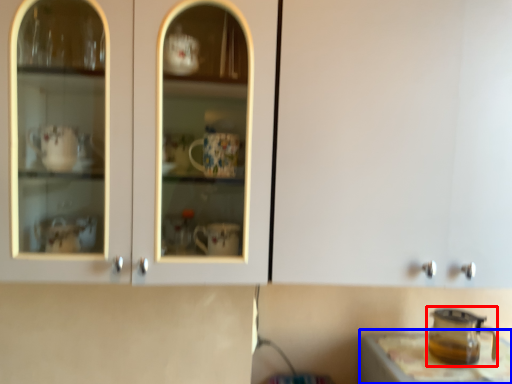
Question: Which of the following is the farthest to the observer, appliance (highlighted by a red box) or table (highlighted by a blue box)?

Choices:
 (A) appliance
 (B) table

Answer: (A)